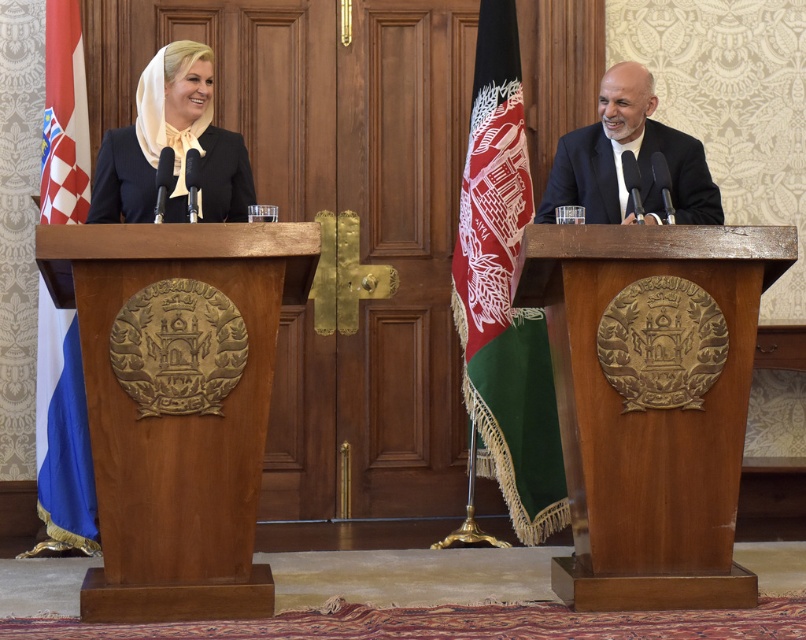
Is wooden podium at center shorter than red fabric flag at right?

Indeed, wooden podium at center has a lesser height compared to red fabric flag at right.

Is wooden podium at center above red fabric flag at right?

Incorrect, wooden podium at center is not positioned above red fabric flag at right.

This screenshot has height=640, width=806. What are the coordinates of `wooden podium at center` in the screenshot? It's located at (649, 416).

Between wooden podium at left and wooden podium at center, which one is positioned higher?

wooden podium at left is higher up.

Can you confirm if wooden podium at left is bigger than wooden podium at center?

Yes.

Which is in front, point (80, 324) or point (667, 529)?

Positioned in front is point (80, 324).

Locate an element on the screen. This screenshot has width=806, height=640. wooden podium at left is located at coordinates (177, 417).

From the picture: Does wooden podium at center appear on the right side of smooth black suit at right?

Yes, wooden podium at center is to the right of smooth black suit at right.

Locate an element on the screen. wooden podium at center is located at coordinates (649, 416).